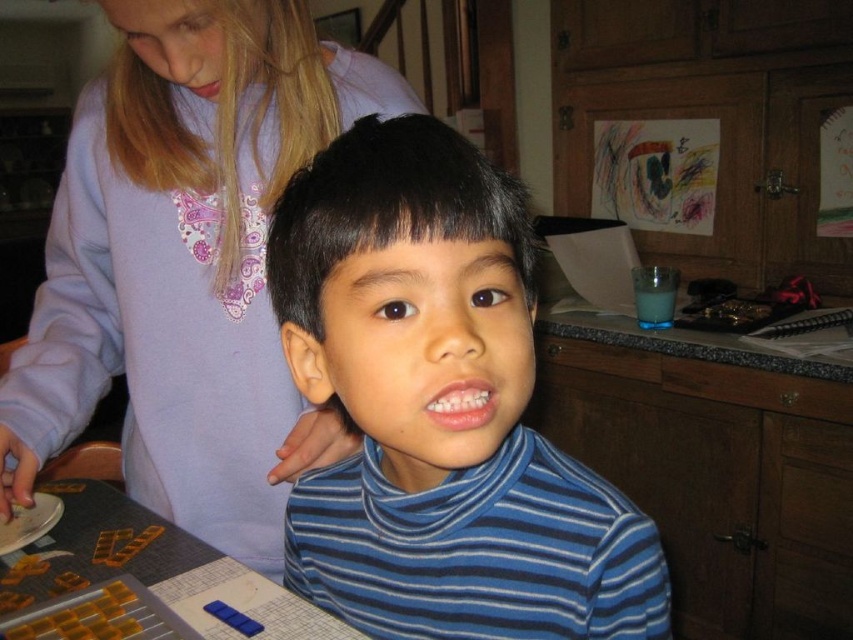
You are a photographer trying to capture a closeup of the purple soft sweater at upper left. The camera you are using has a minimum focusing distance of 28 inches. Can you take the photo without moving either the camera or the sweater?

The purple soft sweater at upper left and camera are 28.32 inches apart. Since the minimum focusing distance is 28 inches, the camera can focus on the purple soft sweater at upper left as the distance is slightly more than the required minimum.

You are a fashion designer observing the scene. You need to determine which of the two sweaters, the blue striped turtleneck at center or the purple soft sweater at upper left, would require a longer hem adjustment if made to the same size. Based on the image, which one would need more lengthening?

The purple soft sweater at upper left would require more hem adjustment because it is longer than the blue striped turtleneck at center.

You are a photographer trying to capture the boy in the blue and white horizontally striped turtleneck sweater. The camera is positioned to focus on the point at coordinates [425,416]. Will this point be on the boy? Please explain.

The point at coordinates [425,416] corresponds to the blue striped turtleneck at center, so yes, the point will be on the boy since the turtleneck is part of his clothing.